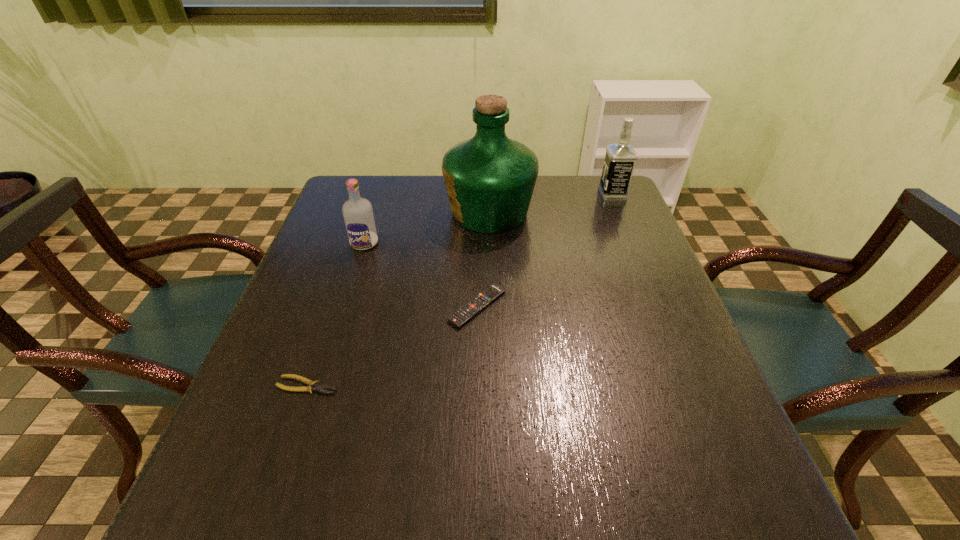
This screenshot has height=540, width=960. What are the coordinates of `vodka at the left edge` in the screenshot? It's located at 358,215.

Image resolution: width=960 pixels, height=540 pixels. Find the location of `pliers that is at the left edge`. pliers that is at the left edge is located at coordinates (313, 385).

Locate an element on the screen. object situated at the right edge is located at coordinates (620, 158).

Locate an element on the screen. The width and height of the screenshot is (960, 540). object present at the far right corner is located at coordinates (620, 158).

The width and height of the screenshot is (960, 540). I want to click on free space at the far edge of the desktop, so click(x=405, y=212).

What are the coordinates of `free spot at the left edge of the desktop` in the screenshot? It's located at (345, 253).

The image size is (960, 540). In the image, there is a desktop. Find the location of `vacant region at the right edge`. vacant region at the right edge is located at coordinates (673, 301).

This screenshot has height=540, width=960. In the image, there is a desktop. Identify the location of free space at the far left corner. (350, 178).

The image size is (960, 540). Identify the location of free location at the far right corner of the desktop. (584, 188).

This screenshot has height=540, width=960. Identify the location of vacant area between the remote control and the taller vodka. point(545,250).